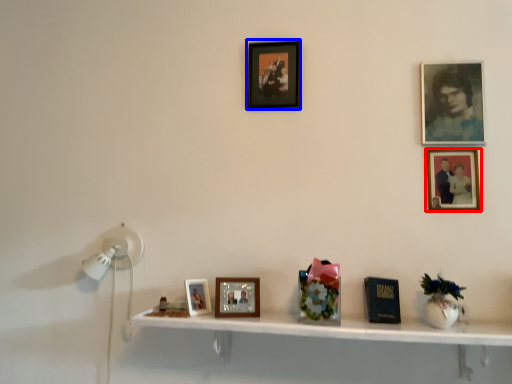
Question: Among these objects, which one is farthest to the camera, picture frame (highlighted by a red box) or picture frame (highlighted by a blue box)?

Choices:
 (A) picture frame
 (B) picture frame

Answer: (B)